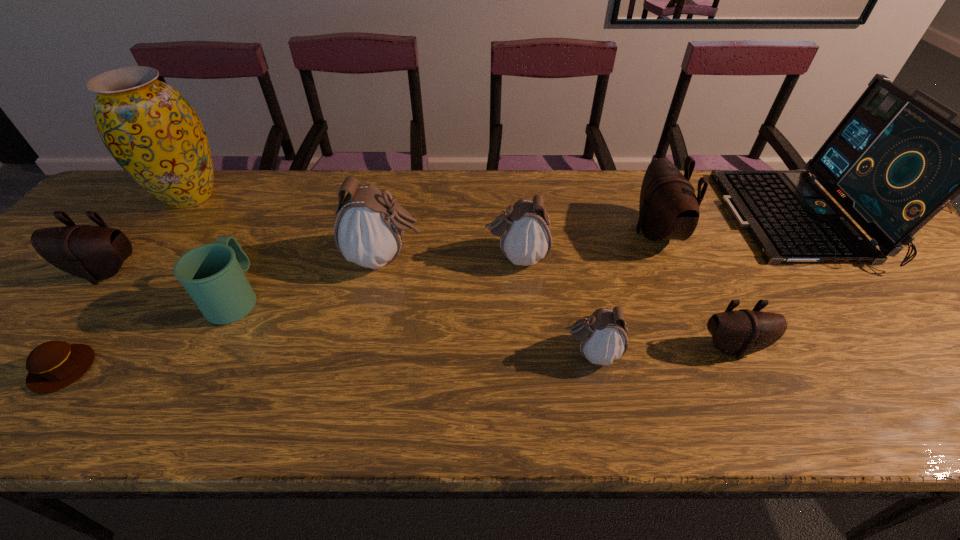
Identify the location of object that is at the right edge. The width and height of the screenshot is (960, 540). (893, 163).

Locate an element on the screen. object located at the far left corner is located at coordinates (150, 129).

Find the location of a particular element. object present at the far right corner is located at coordinates (893, 163).

Find the location of a particular element. free space at the far edge of the desktop is located at coordinates (493, 212).

Locate an element on the screen. vacant area at the near edge is located at coordinates (112, 407).

This screenshot has width=960, height=540. I want to click on empty location between the biggest brown pouch and the nearest brown pouch, so click(694, 290).

Locate an element on the screen. empty space between the laptop computer and the nearest brown pouch is located at coordinates (765, 284).

I want to click on free space between the leftmost brown pouch and the second biggest white pouch, so click(311, 265).

This screenshot has height=540, width=960. Find the location of `free spot between the nearest brown pouch and the mug`. free spot between the nearest brown pouch and the mug is located at coordinates (484, 322).

Find the location of a particular element. free spot between the second biggest brown pouch and the rightmost object is located at coordinates (452, 246).